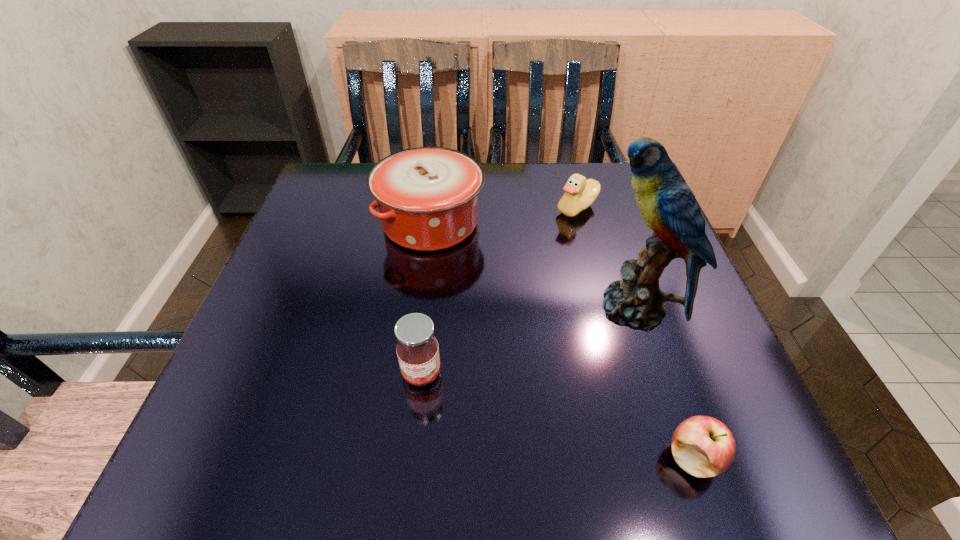
Locate an element on the screen. free space between the shortest object and the fourth farthest object is located at coordinates (558, 415).

Select which object is the closest to the fourth farthest object. Please provide its 2D coordinates. Your answer should be formatted as a tuple, i.e. [(x, y)], where the tuple contains the x and y coordinates of a point satisfying the conditions above.

[(427, 197)]

Locate an element on the screen. The image size is (960, 540). object that stands as the fourth closest to the fourth tallest object is located at coordinates (704, 447).

Where is `vacant region that satisfies the following two spatial constraints: 1. on the label side of the shortest object; 2. on the left side of the third shortest object`? The width and height of the screenshot is (960, 540). vacant region that satisfies the following two spatial constraints: 1. on the label side of the shortest object; 2. on the left side of the third shortest object is located at coordinates (413, 458).

This screenshot has height=540, width=960. In order to click on vacant area that satisfies the following two spatial constraints: 1. at the beak of the second shortest object; 2. on the label side of the jam in this screenshot , I will do `click(620, 373)`.

What are the coordinates of `free space in the image that satisfies the following two spatial constraints: 1. on the back side of the nearest object; 2. on the face of the parrot` in the screenshot? It's located at (642, 309).

Identify the location of free space that satisfies the following two spatial constraints: 1. at the beak of the duck; 2. on the back side of the apple. (642, 458).

Image resolution: width=960 pixels, height=540 pixels. Find the location of `free location that satisfies the following two spatial constraints: 1. on the label side of the fourth farthest object; 2. on the left side of the shortest object`. free location that satisfies the following two spatial constraints: 1. on the label side of the fourth farthest object; 2. on the left side of the shortest object is located at coordinates (413, 458).